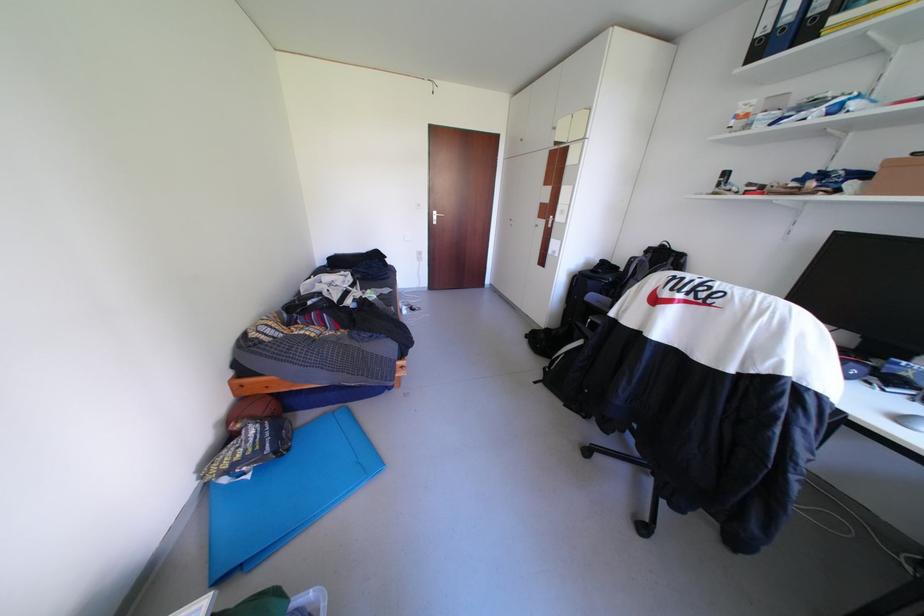
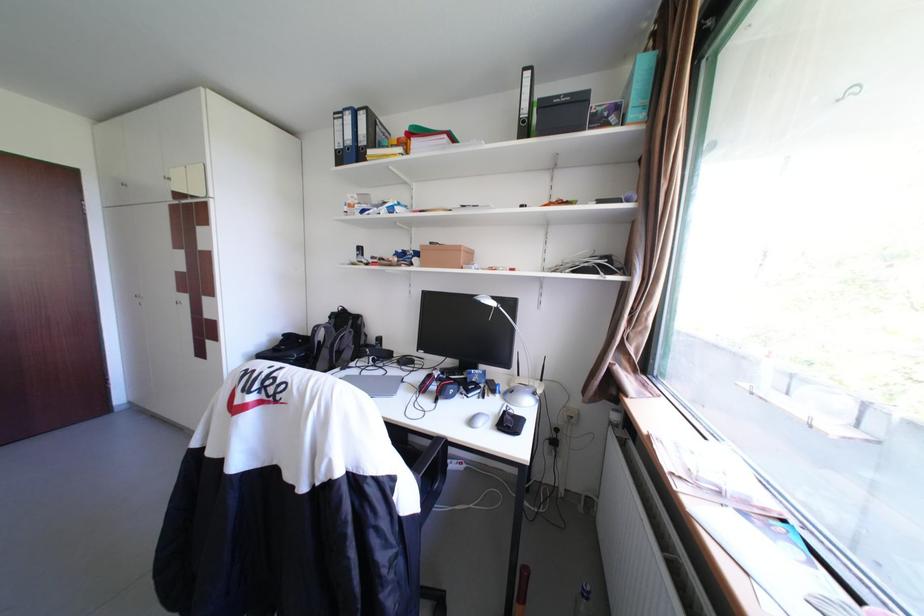
The point at (660, 254) is marked in the first image. Where is the corresponding point in the second image?

(344, 321)